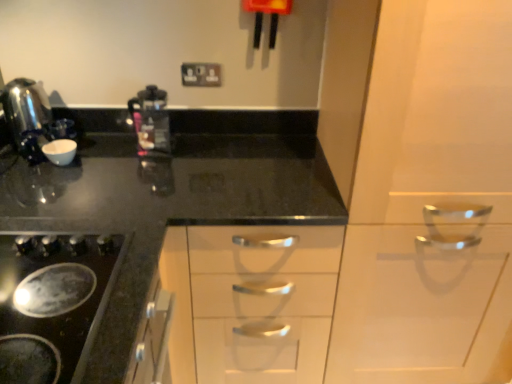
Question: Is white glossy cabinet at center facing away from transparent plastic coffee machine at center?

Choices:
 (A) yes
 (B) no

Answer: (B)

Question: From the image's perspective, is white glossy cabinet at center over transparent plastic coffee machine at center?

Choices:
 (A) yes
 (B) no

Answer: (B)

Question: Is white glossy cabinet at center to the right of transparent plastic coffee machine at center from the viewer's perspective?

Choices:
 (A) yes
 (B) no

Answer: (A)

Question: Considering the relative sizes of white glossy cabinet at center and transparent plastic coffee machine at center in the image provided, is white glossy cabinet at center smaller than transparent plastic coffee machine at center?

Choices:
 (A) yes
 (B) no

Answer: (B)

Question: Are white glossy cabinet at center and transparent plastic coffee machine at center making contact?

Choices:
 (A) yes
 (B) no

Answer: (B)

Question: Is white glossy cabinet at center closer to the viewer compared to transparent plastic coffee machine at center?

Choices:
 (A) no
 (B) yes

Answer: (B)

Question: Can you confirm if white glossy cabinet at center is thinner than black plastic electric outlet at upper center?

Choices:
 (A) yes
 (B) no

Answer: (B)

Question: From a real-world perspective, is white glossy cabinet at center physically below black plastic electric outlet at upper center?

Choices:
 (A) yes
 (B) no

Answer: (A)

Question: Is white glossy cabinet at center further to the viewer compared to black plastic electric outlet at upper center?

Choices:
 (A) yes
 (B) no

Answer: (B)

Question: From the image's perspective, is white glossy cabinet at center below black plastic electric outlet at upper center?

Choices:
 (A) yes
 (B) no

Answer: (A)

Question: Are white glossy cabinet at center and black plastic electric outlet at upper center making contact?

Choices:
 (A) yes
 (B) no

Answer: (B)

Question: From the image's perspective, does white glossy cabinet at center appear higher than black plastic electric outlet at upper center?

Choices:
 (A) yes
 (B) no

Answer: (B)

Question: Is polished stainless steel kettle at left at the right side of black glass gas stove at lower left?

Choices:
 (A) yes
 (B) no

Answer: (B)